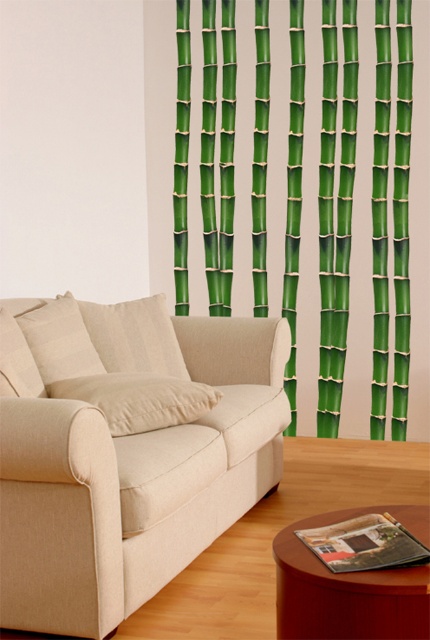
You are planning to rearrange the living room and want to place a new rectangular rug that is 2 meters long. The beige fabric couch at left and the wooden round table at lower right are in the way. Which object should you move first to accommodate the rug without overlapping?

The wooden round table at lower right should be moved first because the beige fabric couch at left is wider than the wooden round table at lower right, making it harder to adjust the couch to fit the rug.

You are a delivery person who needs to place a large package that measures 3 feet in length between the beige fabric couch at left and the wooden round table at lower right. Can you fit the package in the space between them?

The beige fabric couch at left and wooden round table at lower right are 39.17 inches apart from each other. Since 3 feet equals 36 inches, the space between them is sufficient to fit the package as 39.17 inches is greater than 36 inches.